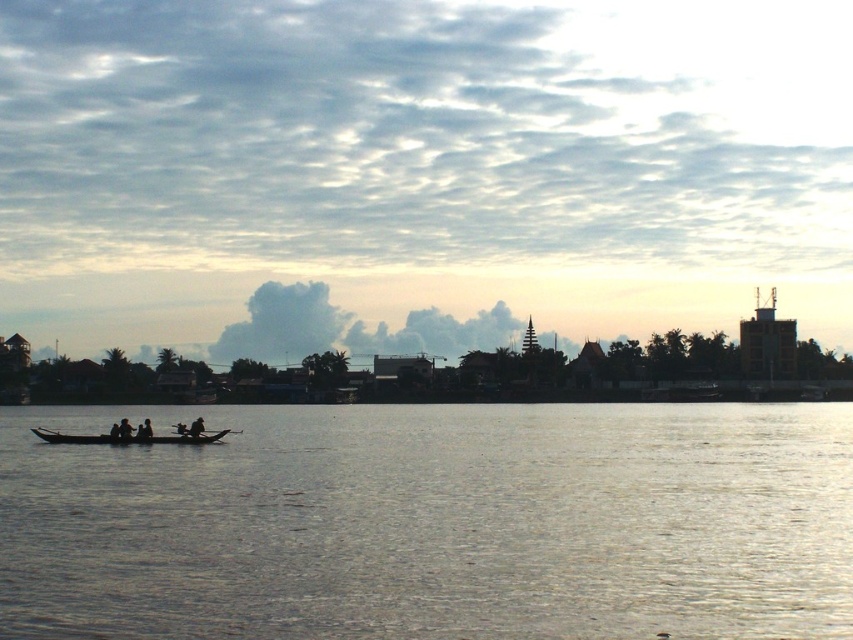
Question: Which of the following is the farthest from the observer?

Choices:
 (A) silhouette wooden boat at left
 (B) dark brown wooden boat at center
 (C) dark skin human at center

Answer: (A)

Question: Is dark skin human at center above dark brown wooden boat at center?

Choices:
 (A) no
 (B) yes

Answer: (A)

Question: Among these points, which one is farthest from the camera?

Choices:
 (A) (196, 433)
 (B) (148, 419)

Answer: (B)

Question: Among these points, which one is nearest to the camera?

Choices:
 (A) coord(125,424)
 (B) coord(184,440)
 (C) coord(144,436)

Answer: (B)

Question: Can you confirm if wooden canoe at lower left is positioned above dark skin human at center?

Choices:
 (A) no
 (B) yes

Answer: (A)

Question: Can you confirm if wooden canoe at lower left is positioned below dark brown wooden boat at center?

Choices:
 (A) no
 (B) yes

Answer: (B)